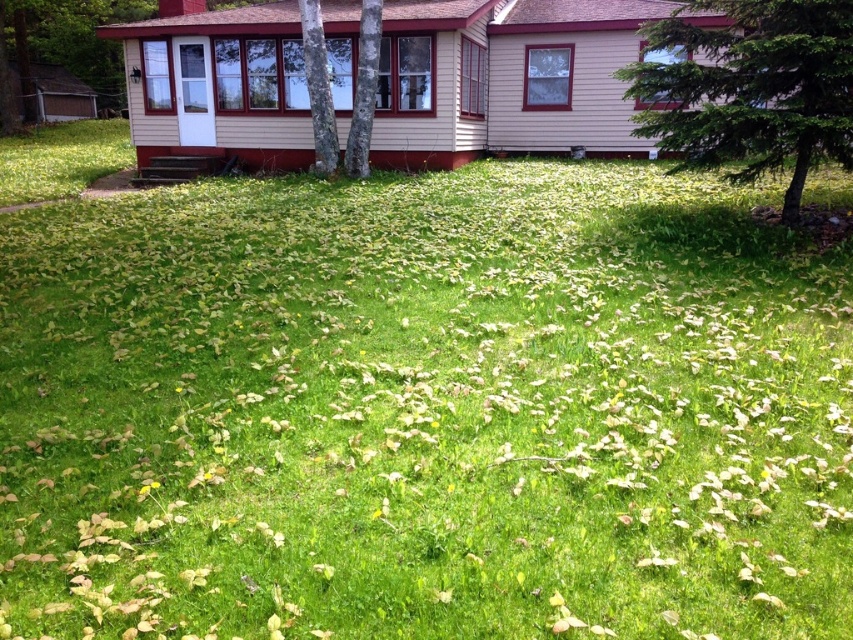
You are standing on the front porch of the house and looking at the green leafy tree at center and the smooth gray bark at center. Which object is closer to you?

The green leafy tree at center is closer to you because it is positioned below the smooth gray bark at center, indicating it is in a lower plane.

You are standing at the point marked by point [318,88] in the residential scene. Looking around, you see a smooth bark tree at center. Which direction should you walk to reach the smooth bark tree at center?

Since point [318,88] marks the smooth bark tree at center, you are already at the location of the smooth bark tree at center.

You are a gardener planning to plant a new tree in the backyard of the house. You want to ensure that the new tree will not block the sunlight coming through the house windows. Based on the scene, which tree between the green leafy tree at center and the smooth bark tree at center is shorter and thus less likely to obstruct the sunlight?

The green leafy tree at center is not as tall as the smooth bark tree at center, so it is shorter and less likely to obstruct the sunlight.